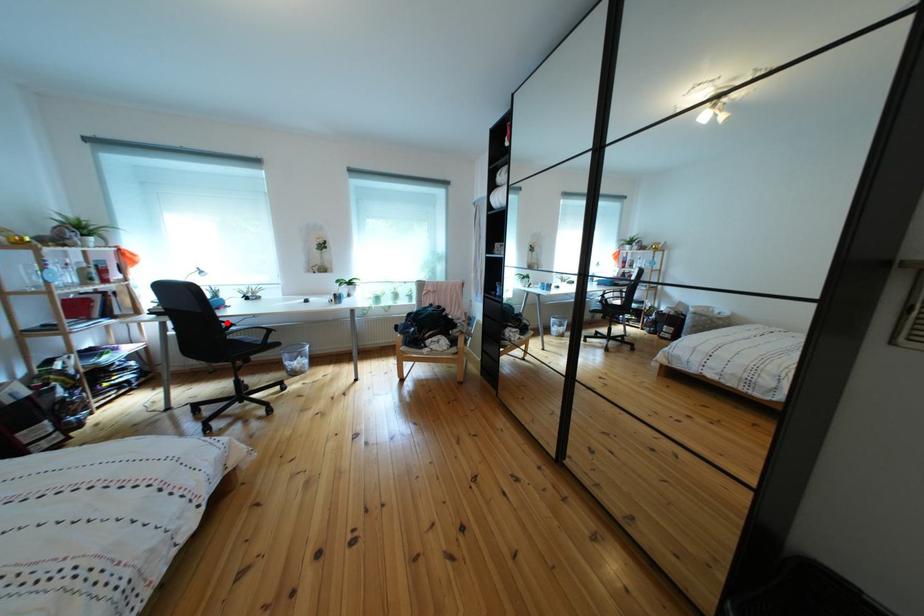
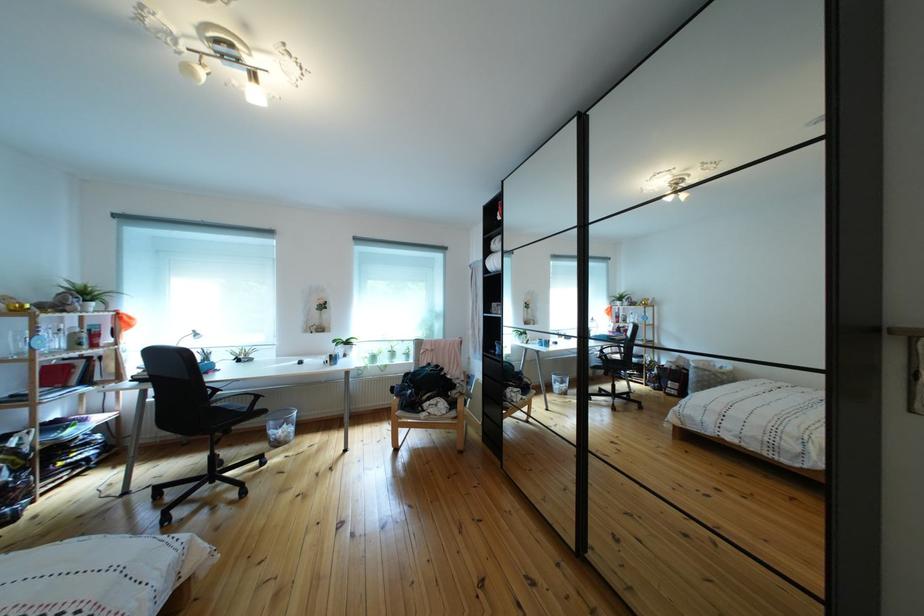
Question: A red point is marked in image1. In image2, is the corresponding 3D point closer to the camera or farther? Reply with the corresponding letter.

Choices:
 (A) The corresponding 3D point is closer.
 (B) The corresponding 3D point is farther.

Answer: (B)